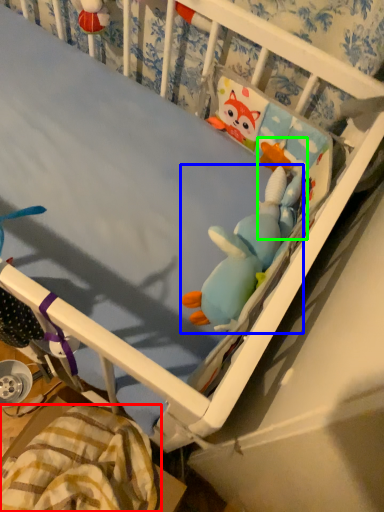
Question: Which is farther away from blanket (highlighted by a red box)? toy (highlighted by a blue box) or toy (highlighted by a green box)?

Choices:
 (A) toy
 (B) toy

Answer: (B)